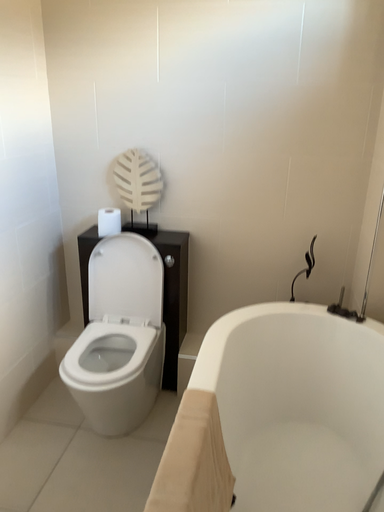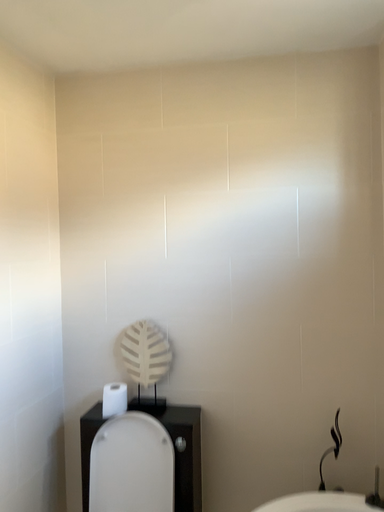
Question: How did the camera likely rotate when shooting the video?

Choices:
 (A) rotated upward
 (B) rotated downward

Answer: (A)